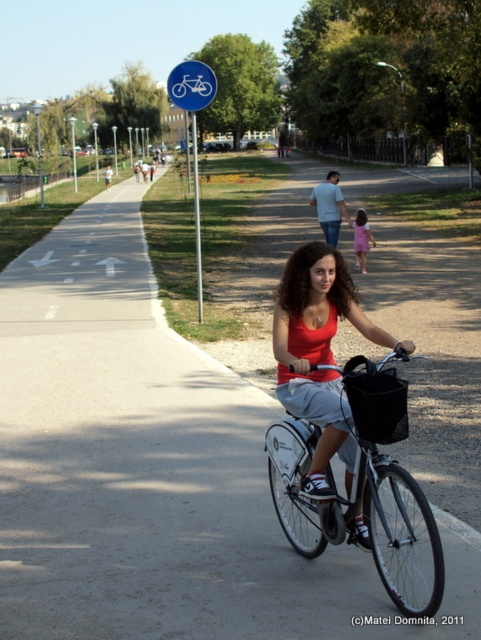
Question: From the image, what is the correct spatial relationship of matte red tank top at center in relation to blue metallic bicycle sign at upper center?

Choices:
 (A) below
 (B) above

Answer: (A)

Question: Considering the relative positions of white matte bicycle at center and pink fabric dress at center in the image provided, where is white matte bicycle at center located with respect to pink fabric dress at center?

Choices:
 (A) right
 (B) left

Answer: (B)

Question: Which point appears farthest from the camera in this image?

Choices:
 (A) [x=339, y=198]
 (B) [x=387, y=531]

Answer: (A)

Question: Does white matte bicycle at center appear under blue metallic bicycle sign at upper center?

Choices:
 (A) no
 (B) yes

Answer: (B)

Question: Considering the real-world distances, which object is farthest from the white matte bicycle at center?

Choices:
 (A) matte red tank top at center
 (B) light blue jeans at center
 (C) pink fabric dress at center

Answer: (B)

Question: Which point is farther from the camera taking this photo?

Choices:
 (A) (309, 388)
 (B) (195, 232)
 (C) (361, 221)

Answer: (B)